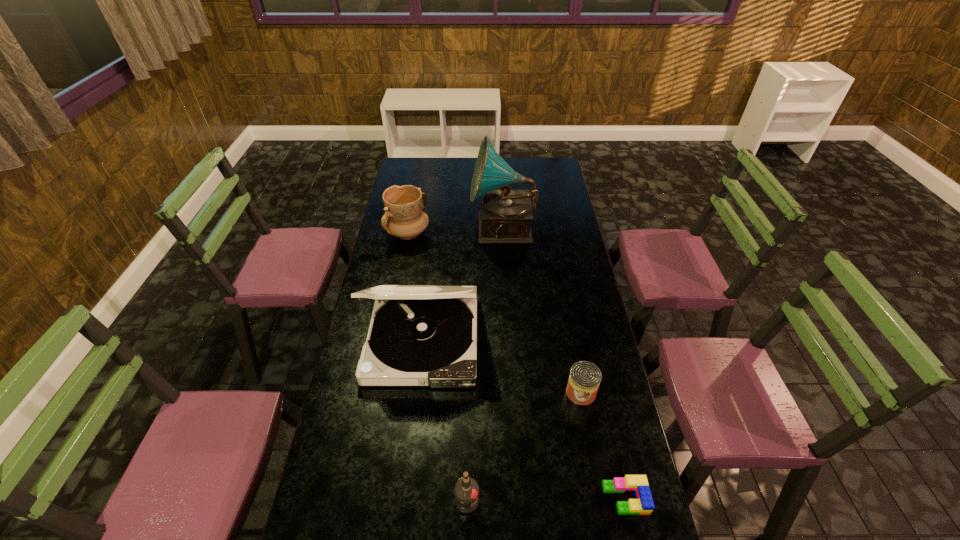
At what (x,y) coordinates should I click in order to perform the action: click on vacant space at the far left corner. Please return your answer as a coordinate pair (x, y). The image size is (960, 540). Looking at the image, I should click on (413, 159).

At what (x,y) coordinates should I click in order to perform the action: click on vacant region between the fourth tallest object and the second tallest object. Please return your answer as a coordinate pair (x, y). Looking at the image, I should click on (444, 420).

At what (x,y) coordinates should I click in order to perform the action: click on empty location between the vodka and the CD player. Please return your answer as a coordinate pair (x, y). The height and width of the screenshot is (540, 960). Looking at the image, I should click on (444, 420).

Find the location of a particular element. vacant space that's between the Lego and the second tallest object is located at coordinates (524, 418).

Where is `empty space between the vodka and the CD player`? This screenshot has width=960, height=540. empty space between the vodka and the CD player is located at coordinates (444, 420).

This screenshot has height=540, width=960. In order to click on free space between the third tallest object and the Lego in this screenshot , I will do `click(516, 366)`.

Find the location of a particular element. free space between the fourth tallest object and the can is located at coordinates (524, 446).

Find the location of a particular element. The width and height of the screenshot is (960, 540). free space between the third shortest object and the CD player is located at coordinates (444, 420).

I want to click on vacant space in between the fifth shortest object and the can, so tap(502, 366).

Where is `vacant space that is in between the record player and the CD player`? Image resolution: width=960 pixels, height=540 pixels. vacant space that is in between the record player and the CD player is located at coordinates (463, 285).